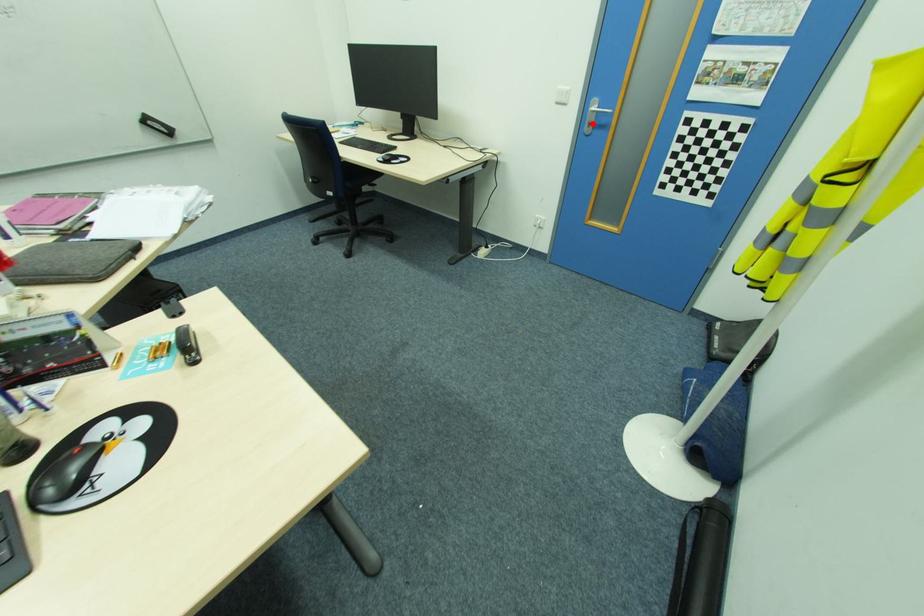
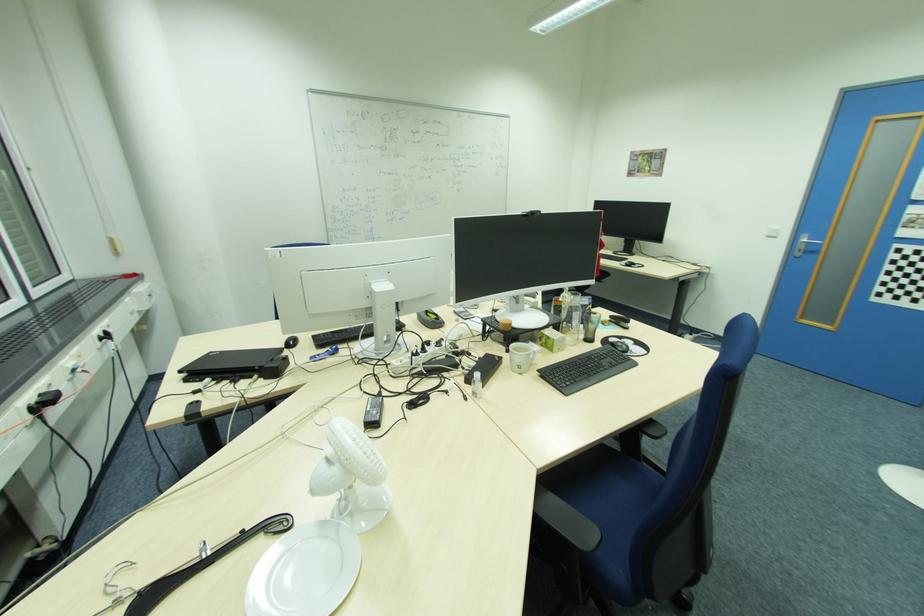
Question: I am providing you with two images of the same scene from different viewpoints. A red point is marked on the first image. Can you still see the location of the red point in image 2?

Choices:
 (A) Yes
 (B) No

Answer: (A)